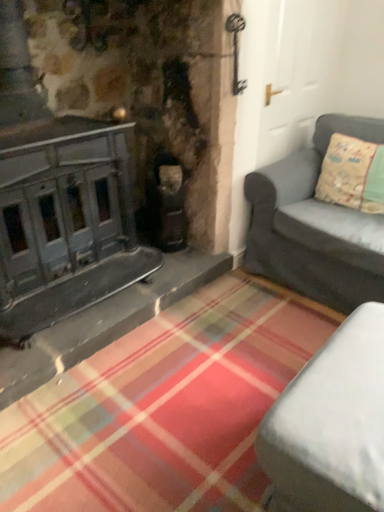
Question: Does point (334, 408) appear closer or farther from the camera than point (374, 121)?

Choices:
 (A) closer
 (B) farther

Answer: (A)

Question: From a real-world perspective, is white fabric studio couch at lower right, marked as the 1th studio couch in a bottom-to-top arrangement, physically located above or below matte gray couch at right, which is the second studio couch in front-to-back order?

Choices:
 (A) below
 (B) above

Answer: (A)

Question: Based on their relative distances, which object is nearer to the matte gray couch at right, the 1th studio couch when ordered from back to front?

Choices:
 (A) light green fabric pillow at right
 (B) white fabric studio couch at lower right, which is counted as the second studio couch, starting from the top

Answer: (A)

Question: Which of these objects is positioned farthest from the white fabric studio couch at lower right, which is counted as the second studio couch, starting from the top?

Choices:
 (A) matte gray couch at right, which is the second studio couch in front-to-back order
 (B) light green fabric pillow at right

Answer: (B)